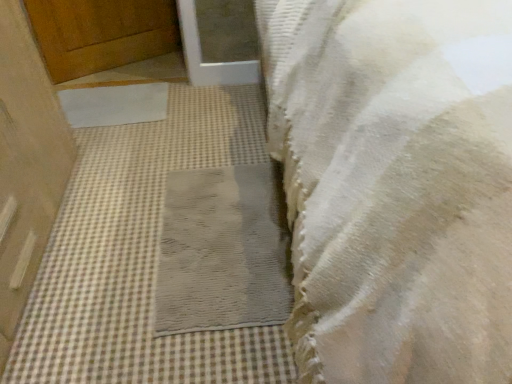
At what (x,y) coordinates should I click in order to perform the action: click on free spot below white matte mat at center, the 2th mat in the bottom-to-top sequence (from a real-world perspective). Please return your answer as a coordinate pair (x, y). This screenshot has width=512, height=384. Looking at the image, I should click on (113, 102).